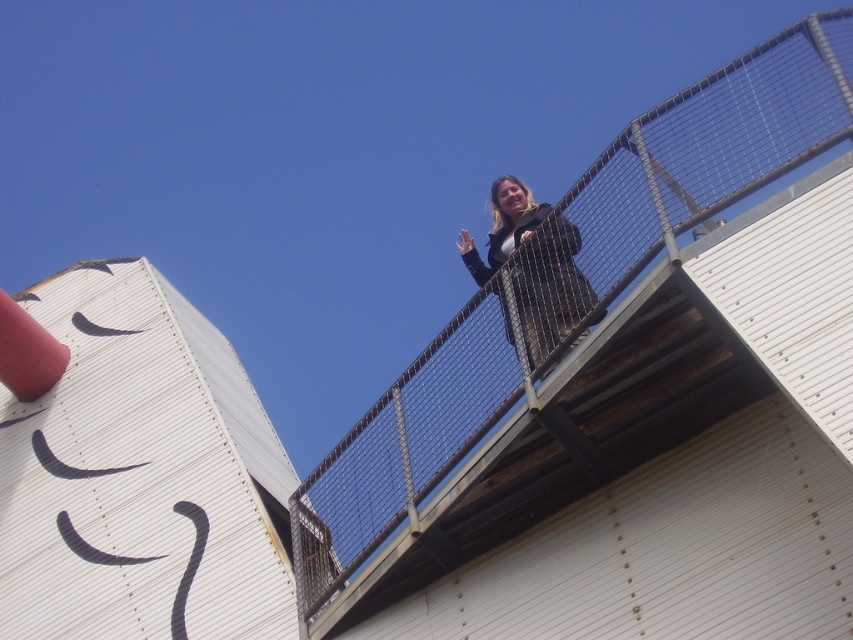
Is metal mesh railing at upper center below matte black jacket at upper center?

Indeed, metal mesh railing at upper center is positioned under matte black jacket at upper center.

Between metal mesh railing at upper center and matte black jacket at upper center, which one has more height?

Standing taller between the two is metal mesh railing at upper center.

Between point (671, 221) and point (572, 259), which one is positioned behind?

The point (572, 259) is behind.

You are a GUI agent. You are given a task and a screenshot of the screen. Output one action in this format:
    pyautogui.click(x=<x>, y=<y>)
    Task: Click on the metal mesh railing at upper center
    
    Given the screenshot: What is the action you would take?
    pyautogui.click(x=625, y=396)